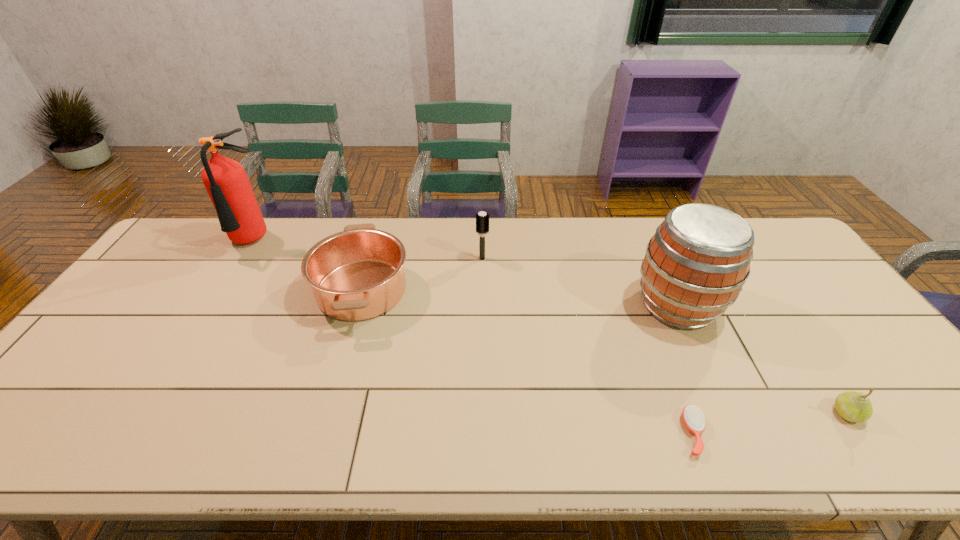
Identify the location of vacant space situated on the back of the cider. (644, 233).

At what (x,y) coordinates should I click in order to perform the action: click on vacant space located on the right of the third object from left to right. Please return your answer as a coordinate pair (x, y). The height and width of the screenshot is (540, 960). Looking at the image, I should click on (551, 258).

Where is `free space located on the front of the saucepan`? Image resolution: width=960 pixels, height=540 pixels. free space located on the front of the saucepan is located at coordinates (330, 400).

I want to click on free region located on the left of the rightmost object, so click(750, 413).

Where is `vacant region located on the left of the right hairbrush`? This screenshot has width=960, height=540. vacant region located on the left of the right hairbrush is located at coordinates (573, 433).

This screenshot has width=960, height=540. Identify the location of fire extinguisher located in the far edge section of the desktop. (226, 181).

In order to click on hairbrush that is at the far edge in this screenshot , I will do `click(482, 219)`.

The image size is (960, 540). Find the location of `saucepan present at the far edge`. saucepan present at the far edge is located at coordinates (357, 274).

Identify the location of pear positioned at the near edge. (853, 406).

The width and height of the screenshot is (960, 540). In order to click on hairbrush located at the near edge in this screenshot , I will do `click(693, 418)`.